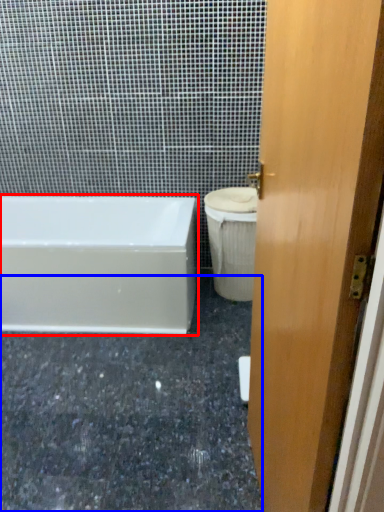
Question: Which object appears farthest to the camera in this image, bathtub (highlighted by a red box) or granite (highlighted by a blue box)?

Choices:
 (A) bathtub
 (B) granite

Answer: (A)